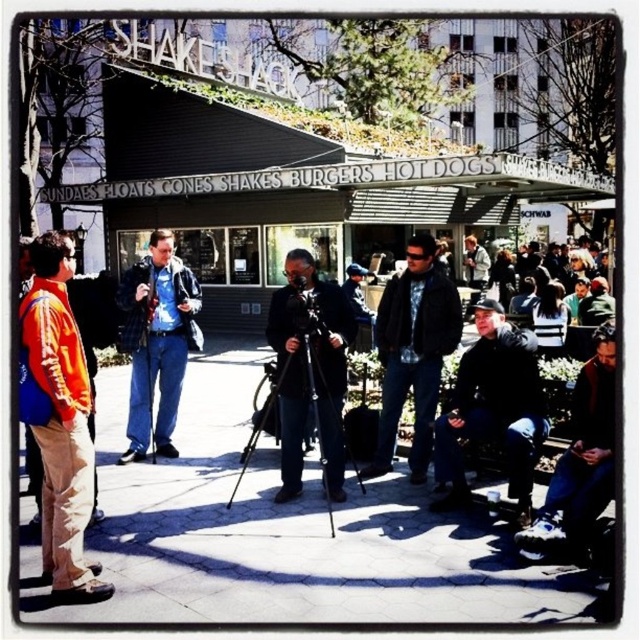
Question: Which of the following is the farthest from the observer?

Choices:
 (A) orange jacket at left
 (B) matte black camera at center
 (C) dark blue jeans at lower right

Answer: (B)

Question: Can you confirm if black matte tripod at center is positioned below black plastic video camera at center?

Choices:
 (A) yes
 (B) no

Answer: (A)

Question: Which point appears closest to the camera in this image?

Choices:
 (A) (413, 376)
 (B) (346, 296)
 (C) (564, 483)

Answer: (C)

Question: Estimate the real-world distances between objects in this image. Which object is closer to the black leather jacket at lower right?

Choices:
 (A) orange jacket at left
 (B) matte black camera at center
 (C) dark blue jeans at lower right
 (D) denim jacket at center

Answer: (C)

Question: Does denim jacket at center have a greater width compared to matte black camera at center?

Choices:
 (A) yes
 (B) no

Answer: (A)

Question: Is denim jacket at center smaller than dark blue jeans at lower right?

Choices:
 (A) yes
 (B) no

Answer: (B)